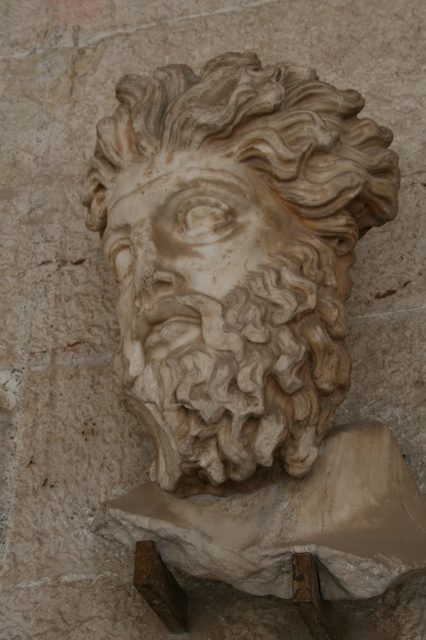
Question: Observing the image, what is the correct spatial positioning of white marble lion at center in reference to white marble face at center?

Choices:
 (A) below
 (B) above

Answer: (A)

Question: Is white marble lion at center above white marble face at center?

Choices:
 (A) no
 (B) yes

Answer: (A)

Question: Is white marble lion at center to the right of white marble face at center from the viewer's perspective?

Choices:
 (A) yes
 (B) no

Answer: (A)

Question: Which object is farther from the camera taking this photo?

Choices:
 (A) white marble face at center
 (B) white marble lion at center

Answer: (A)

Question: Which of the following is the closest to the observer?

Choices:
 (A) (235, 268)
 (B) (164, 474)

Answer: (A)